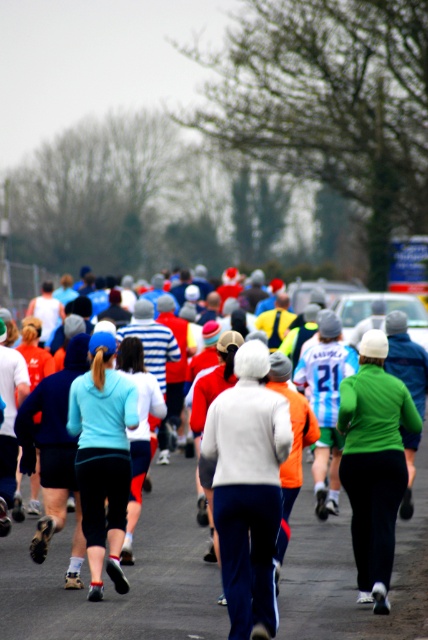
Does green matte jacket at center have a lesser width compared to light blue jersey at center?

In fact, green matte jacket at center might be wider than light blue jersey at center.

Find the location of a particular element. green matte jacket at center is located at coordinates (374, 464).

Is white fleece jacket at center taller than green matte jacket at center?

No.

Which of these two, white fleece jacket at center or green matte jacket at center, stands taller?

Standing taller between the two is green matte jacket at center.

Does point (231, 436) come farther from viewer compared to point (377, 355)?

That is False.

Where is `white fleece jacket at center`? white fleece jacket at center is located at coordinates (246, 490).

Is matte white jacket at center to the right of green matte jacket at center from the viewer's perspective?

No, matte white jacket at center is not to the right of green matte jacket at center.

Which is in front, point (5, 580) or point (385, 573)?

Point (385, 573) is in front.

Find the location of `matte white jacket at center`. matte white jacket at center is located at coordinates (127, 577).